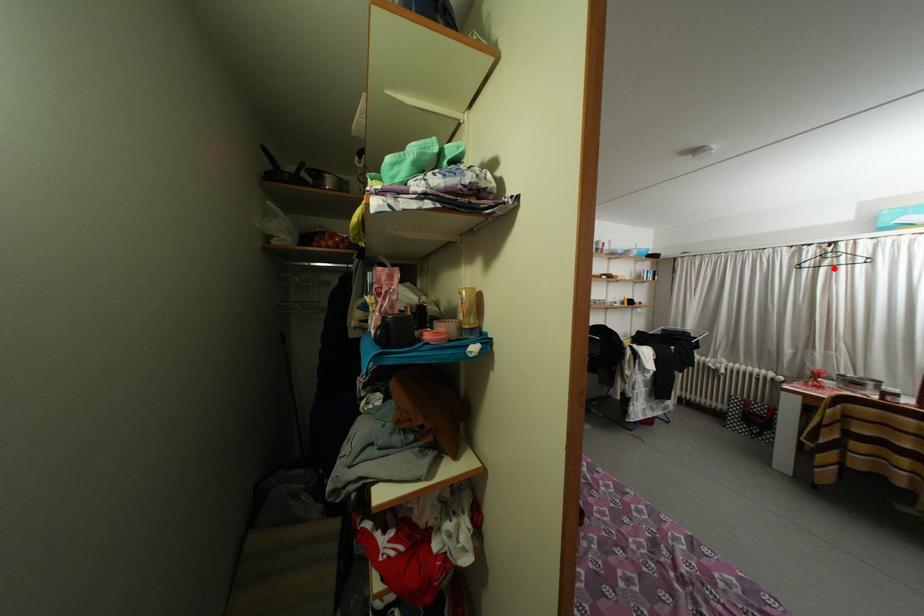
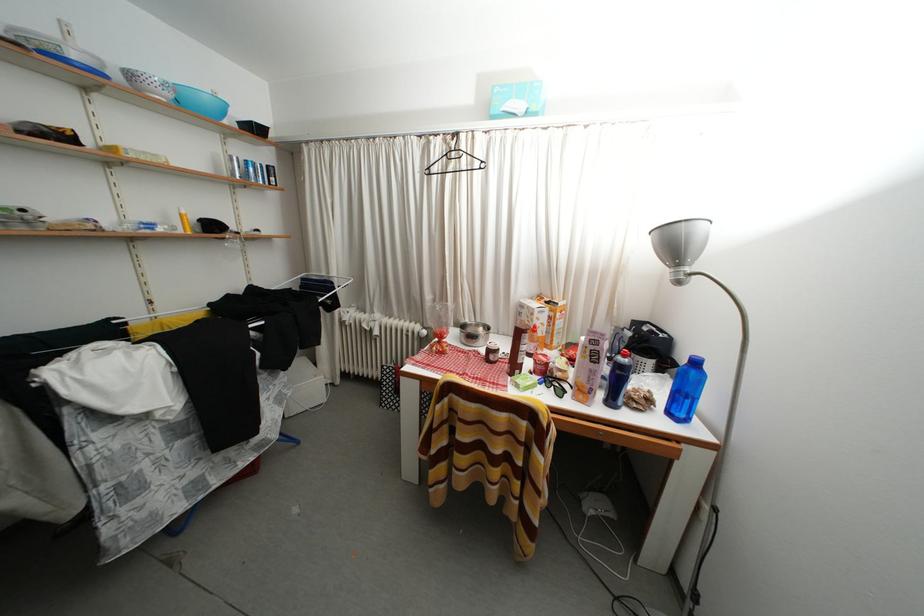
Find the pixel in the second image that matches the highlighted location in the first image.

(458, 172)